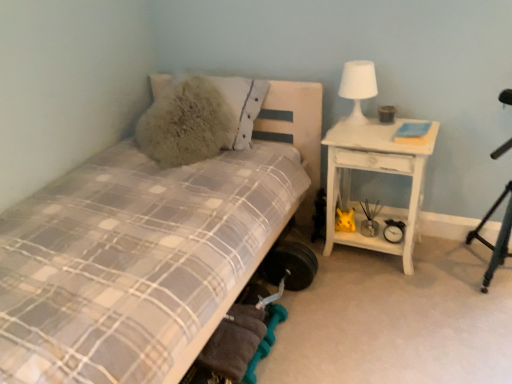
Locate an element on the screen. This screenshot has width=512, height=384. free space in front of white wood nightstand at right is located at coordinates point(395,301).